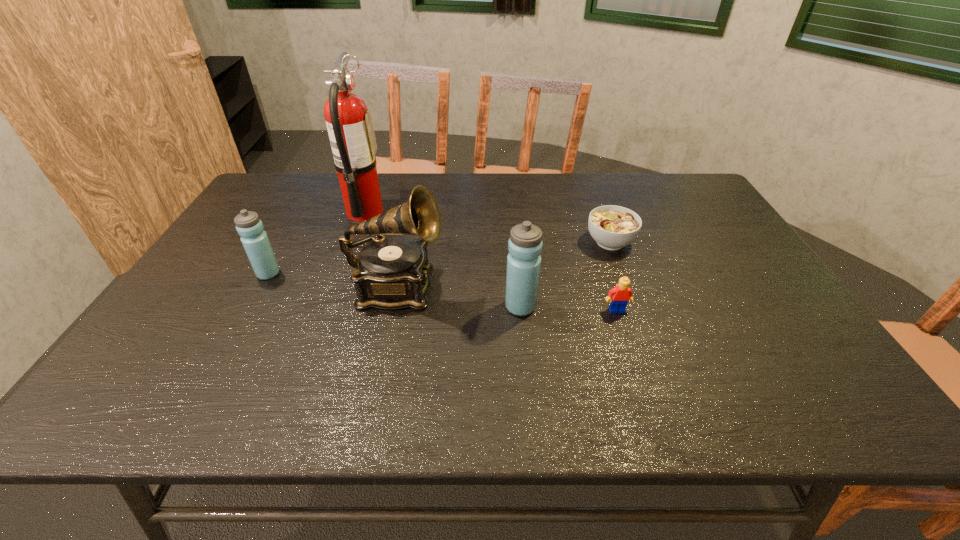
Locate an element on the screen. This screenshot has height=540, width=960. object identified as the fifth closest to the shorter water bottle is located at coordinates point(613,227).

Locate an element on the screen. This screenshot has width=960, height=540. vacant space that satisfies the following two spatial constraints: 1. on the back side of the third tallest object; 2. on the horn of the fifth shortest object is located at coordinates (518, 288).

At what (x,y) coordinates should I click in order to perform the action: click on vacant space that satisfies the following two spatial constraints: 1. on the horn of the phonograph record; 2. on the back side of the right water bottle. Please return your answer as a coordinate pair (x, y). Looking at the image, I should click on (395, 307).

This screenshot has width=960, height=540. In order to click on free point that satisfies the following two spatial constraints: 1. on the front side of the fourth shortest object; 2. on the left side of the left water bottle in this screenshot , I will do `click(250, 307)`.